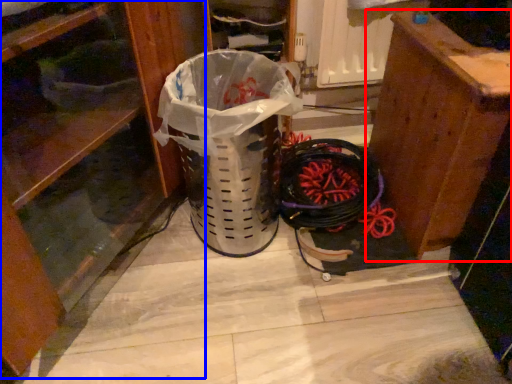
Question: Among these objects, which one is nearest to the camera, furniture (highlighted by a red box) or dresser (highlighted by a blue box)?

Choices:
 (A) furniture
 (B) dresser

Answer: (B)